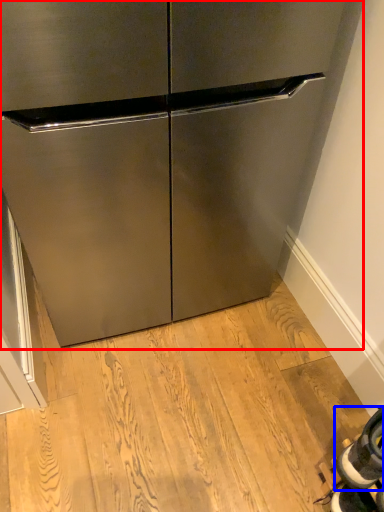
Question: Which object appears farthest to the camera in this image, cabinetry (highlighted by a red box) or shoe (highlighted by a blue box)?

Choices:
 (A) cabinetry
 (B) shoe

Answer: (B)